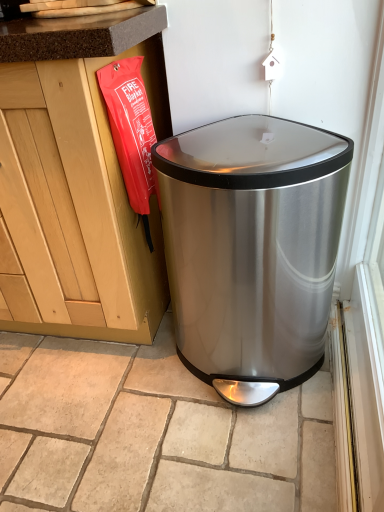
You are a GUI agent. You are given a task and a screenshot of the screen. Output one action in this format:
    pyautogui.click(x=<x>, y=<y>)
    Task: Click on the free spot above beige stone tile at center (from a real-world perspective)
    The image size is (384, 512).
    Given the screenshot: What is the action you would take?
    pyautogui.click(x=134, y=404)